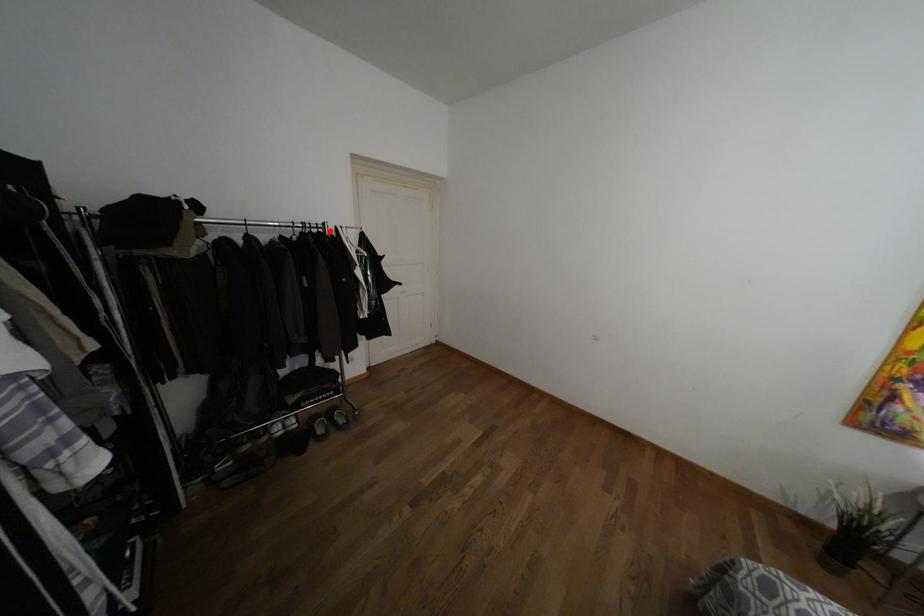
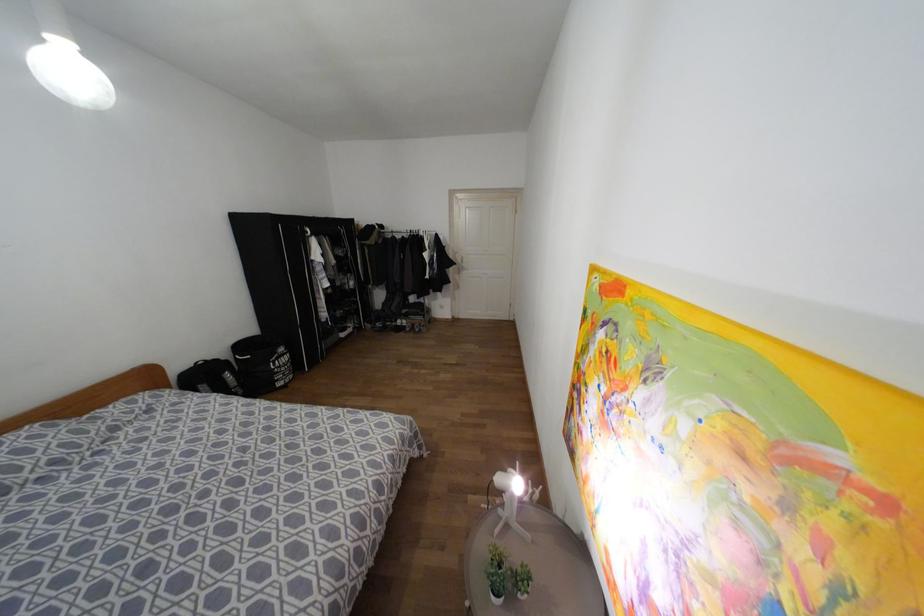
The point at the highlighted location is marked in the first image. Where is the corresponding point in the second image?

(419, 233)